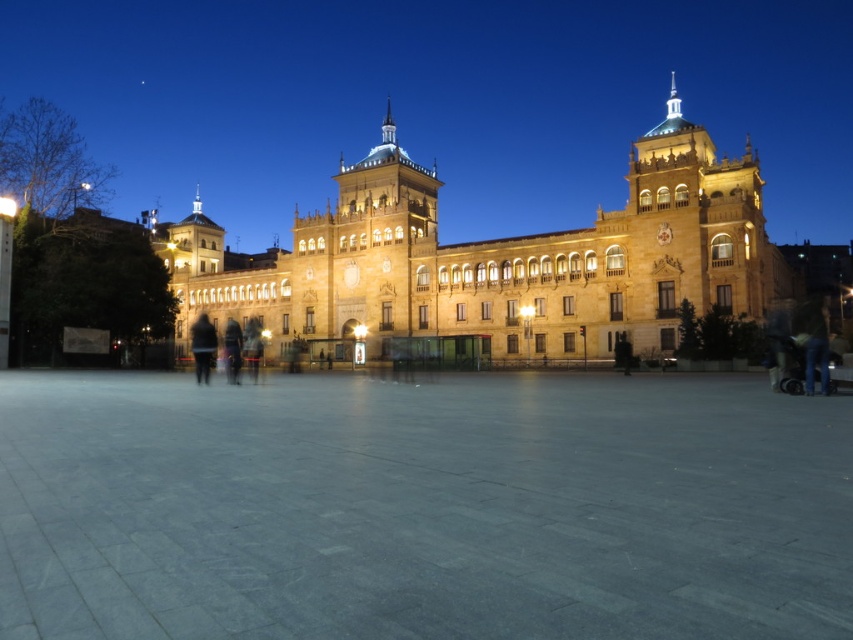
Can you confirm if gray stone pavement at center is positioned to the left of black matte jacket at center?

Incorrect, gray stone pavement at center is not on the left side of black matte jacket at center.

Is point (457, 541) closer to viewer compared to point (202, 381)?

That is True.

Which is behind, point (486, 588) or point (201, 348)?

The point (201, 348) is behind.

Find the location of a particular element. This screenshot has height=640, width=853. gray stone pavement at center is located at coordinates (421, 508).

Is golden stone palace at center in front of dark fabric person at center?

Yes, golden stone palace at center is in front of dark fabric person at center.

Which of these two, golden stone palace at center or dark fabric person at center, stands taller?

golden stone palace at center is taller.

Between point (749, 282) and point (236, 380), which one is positioned in front?

Point (749, 282) is more forward.

This screenshot has height=640, width=853. What are the coordinates of `golden stone palace at center` in the screenshot? It's located at coord(498,259).

Is point (387, 561) farther from camera compared to point (583, 257)?

No.

Locate an element on the screen. The image size is (853, 640). gray stone pavement at center is located at coordinates (421, 508).